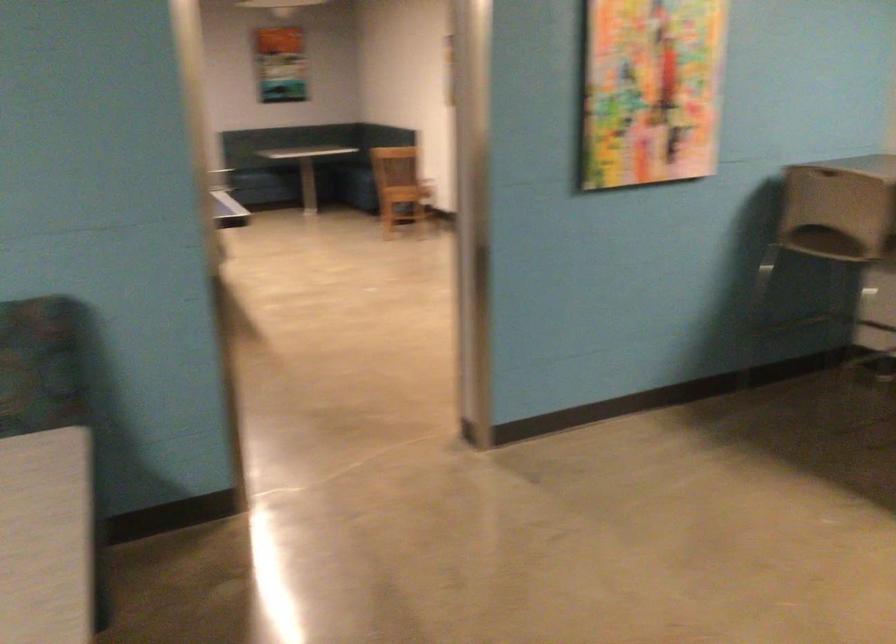
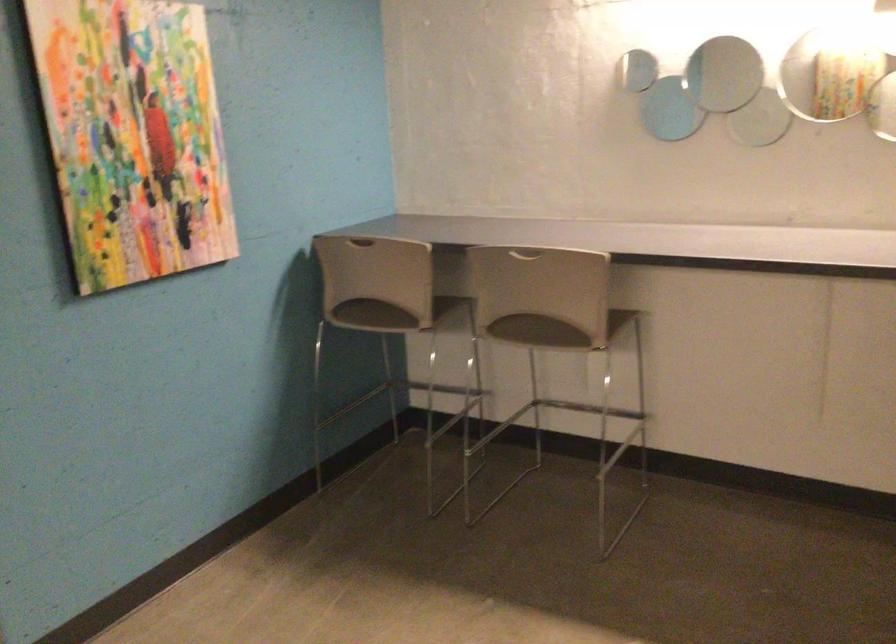
Question: The first image is from the beginning of the video and the second image is from the end. How did the camera likely rotate when shooting the video?

Choices:
 (A) Left
 (B) Right
 (C) Up
 (D) Down

Answer: (B)